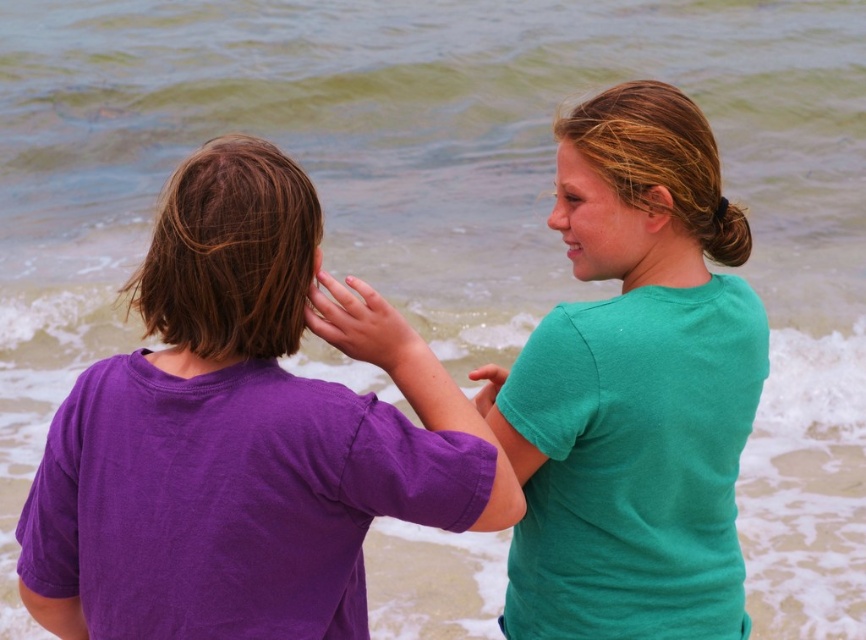
Does point (31, 552) come in front of point (490, 390)?

Yes.

Who is higher up, purple cotton shirt at left or matte green shirt at upper right?

matte green shirt at upper right is higher up.

Between point (225, 419) and point (502, 369), which one is positioned behind?

The point (502, 369) is more distant.

This screenshot has height=640, width=866. Identify the location of purple cotton shirt at left. (236, 440).

Can you confirm if purple cotton shirt at left is shorter than green matte shirt at upper right?

Yes.

Is the position of purple cotton shirt at left less distant than that of green matte shirt at upper right?

That is True.

Locate an element on the screen. This screenshot has height=640, width=866. purple cotton shirt at left is located at coordinates (236, 440).

From the picture: Is green matte shirt at upper right taller than matte skin hand at center?

Yes, green matte shirt at upper right is taller than matte skin hand at center.

Which is behind, point (622, 248) or point (313, 316)?

Point (622, 248)

In order to click on green matte shirt at upper right in this screenshot , I will do `click(635, 388)`.